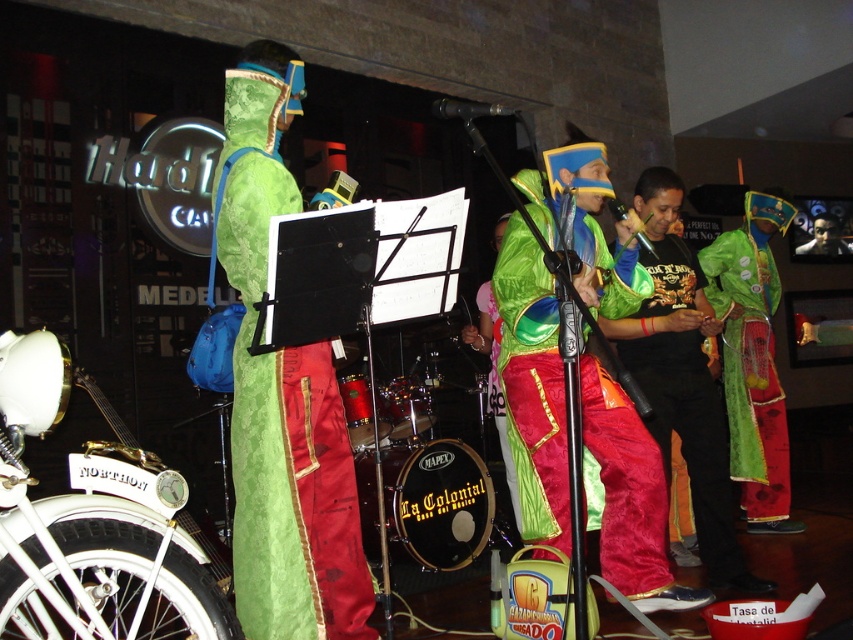
Does velvet green and red costume at center have a greater height compared to green velvet robe at center?

No, velvet green and red costume at center is not taller than green velvet robe at center.

Is velvet green and red costume at center positioned before green velvet robe at center?

Yes, velvet green and red costume at center is in front of green velvet robe at center.

You are a GUI agent. You are given a task and a screenshot of the screen. Output one action in this format:
    pyautogui.click(x=<x>, y=<y>)
    Task: Click on the velvet green and red costume at center
    The width and height of the screenshot is (853, 640).
    Given the screenshot: What is the action you would take?
    pyautogui.click(x=532, y=387)

Locate an element on the screen. The height and width of the screenshot is (640, 853). velvet green and red costume at center is located at coordinates [532, 387].

From the picture: Who is lower down, green velvet costume at center or green velvet robe at center?

Positioned lower is green velvet robe at center.

Measure the distance between green velvet costume at center and green velvet robe at center.

A: They are 8.73 feet apart.

The image size is (853, 640). I want to click on green velvet costume at center, so click(x=282, y=403).

Where is `green velvet costume at center`? The width and height of the screenshot is (853, 640). green velvet costume at center is located at coordinates (282, 403).

Who is positioned more to the left, velvet green and red costume at center or velvet green robe at center?

From the viewer's perspective, velvet green and red costume at center appears more on the left side.

Which is in front, point (604, 268) or point (672, 428)?

Point (604, 268) is in front.

Locate an element on the screen. velvet green and red costume at center is located at coordinates (532, 387).